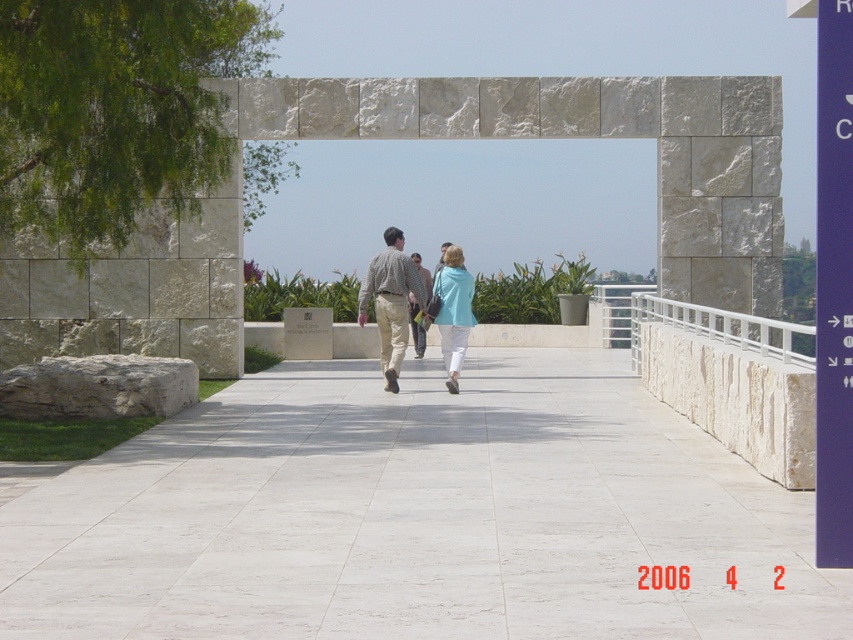
You are a photographer positioned at the entrance of the park. You need to capture a photo of the white marble pavement at center and the matte blue sweater at center as they walk towards the archway. Which object will appear closer to the camera in the photo?

The white marble pavement at center will appear closer to the camera in the photo because it is shorter than the matte blue sweater at center, meaning it is physically nearer to the photographer.

You are standing at the entrance of the park and see the white marble pavement at center and the checkered fabric shirt at center. Which object is closer to you?

The white marble pavement at center is closer to you since it is in front of the checkered fabric shirt at center.

You are standing at the entrance of the park and see the white marble pavement at center and the matte blue sweater at center. Which object is closer to the ground?

The white marble pavement at center is located below matte blue sweater at center, so it is closer to the ground.